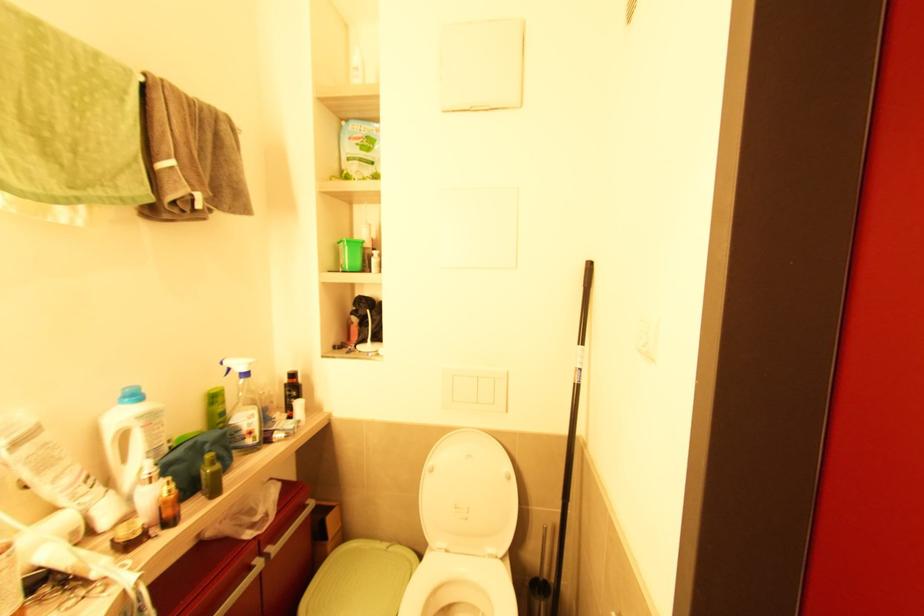
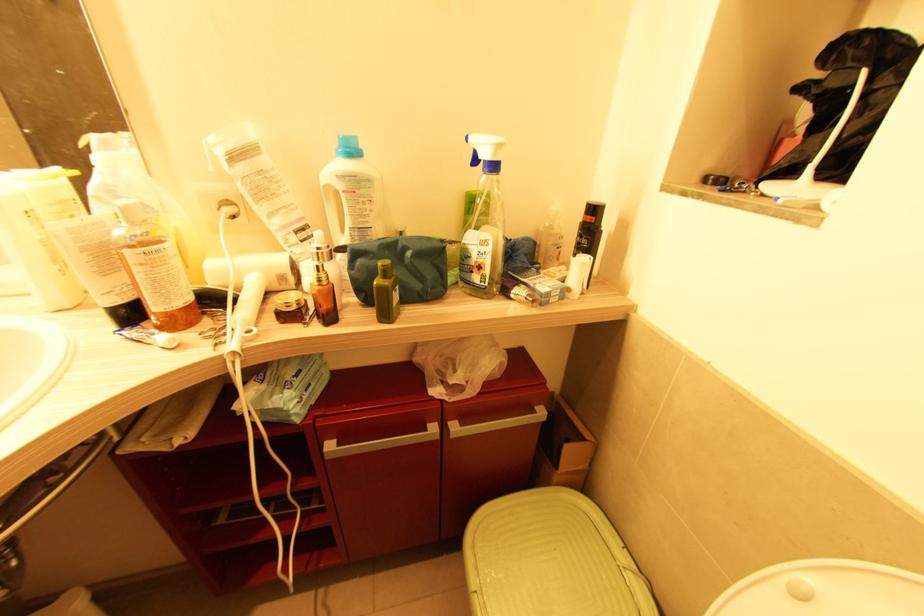
Locate, in the second image, the point that corresponds to (370,312) in the first image.

(867, 73)